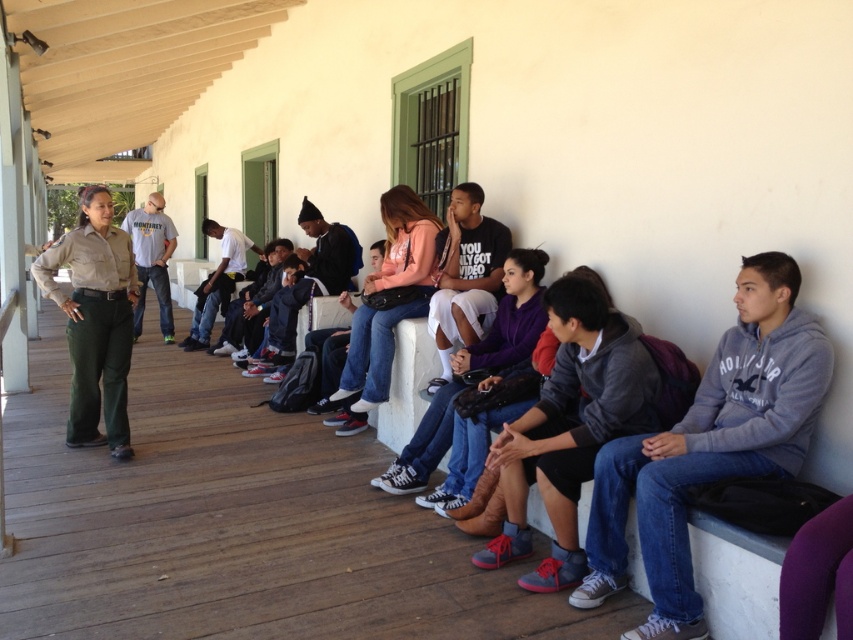
Question: Is gray fleece sweatshirt at center further to the viewer compared to light gray cotton shirt at center?

Choices:
 (A) yes
 (B) no

Answer: (B)

Question: Is gray fleece sweatshirt at center behind light gray cotton shirt at center?

Choices:
 (A) yes
 (B) no

Answer: (B)

Question: Estimate the real-world distances between objects in this image. Which object is closer to the gray fleece sweatshirt at center?

Choices:
 (A) light gray cotton shirt at center
 (B) khaki uniform pants at left

Answer: (B)

Question: Is khaki uniform pants at left further to camera compared to light gray cotton shirt at center?

Choices:
 (A) yes
 (B) no

Answer: (B)

Question: Which point is farther to the camera?

Choices:
 (A) khaki uniform pants at left
 (B) gray fleece sweatshirt at center
 (C) light gray cotton shirt at center

Answer: (C)

Question: Which point appears closest to the camera in this image?

Choices:
 (A) (151, 209)
 (B) (90, 323)

Answer: (B)